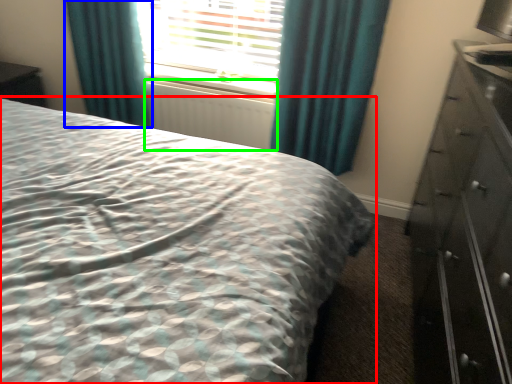
Question: Estimate the real-world distances between objects in this image. Which object is closer to bed (highlighted by a red box), curtain (highlighted by a blue box) or radiator (highlighted by a green box)?

Choices:
 (A) curtain
 (B) radiator

Answer: (B)